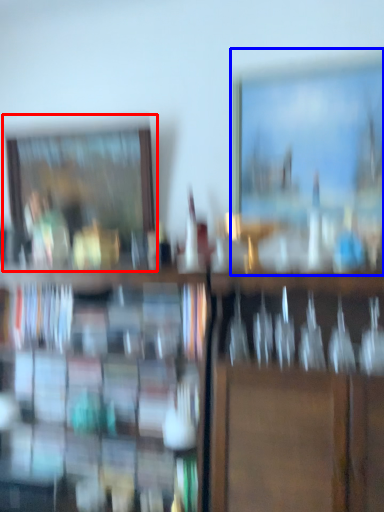
Question: Which object is closer to the camera taking this photo, picture frame (highlighted by a red box) or picture frame (highlighted by a blue box)?

Choices:
 (A) picture frame
 (B) picture frame

Answer: (B)